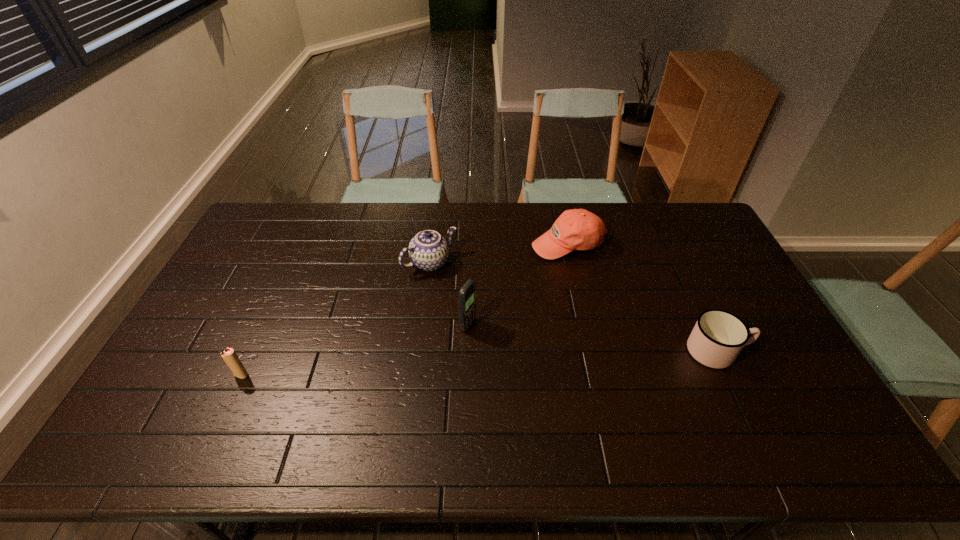
In order to click on free region located on the screen of the cellular telephone in this screenshot , I will do `click(491, 336)`.

I want to click on vacant space located at the spout of the fourth object from right to left, so click(460, 291).

At what (x,y) coordinates should I click in order to perform the action: click on vacant space located at the spout of the fourth object from right to left. Please return your answer as a coordinate pair (x, y). Looking at the image, I should click on (504, 338).

You are a GUI agent. You are given a task and a screenshot of the screen. Output one action in this format:
    pyautogui.click(x=<x>, y=<y>)
    Task: Click on the vacant region located at the spout of the fourth object from right to left
    Image resolution: width=960 pixels, height=540 pixels.
    Given the screenshot: What is the action you would take?
    pyautogui.click(x=488, y=320)

Identify the location of vacant space situated on the front-facing side of the fourth object from left to right. The image size is (960, 540). tap(549, 338).

Where is `vacant area situated on the front-facing side of the fourth object from left to right`? The image size is (960, 540). vacant area situated on the front-facing side of the fourth object from left to right is located at coordinates (550, 333).

This screenshot has width=960, height=540. What are the coordinates of `vacant region located 0.400m on the front-facing side of the fourth object from left to right` in the screenshot? It's located at (546, 354).

The width and height of the screenshot is (960, 540). What are the coordinates of `object at the far edge` in the screenshot? It's located at (577, 229).

This screenshot has height=540, width=960. What are the coordinates of `object present at the right edge` in the screenshot? It's located at (718, 336).

In the image, there is a desktop. Identify the location of free space at the far edge. The width and height of the screenshot is (960, 540). point(621,240).